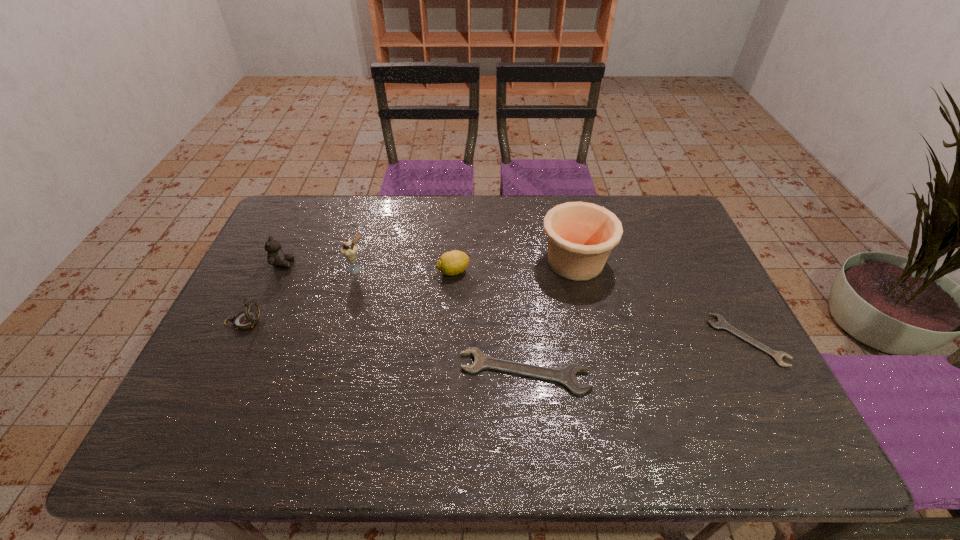
This screenshot has height=540, width=960. In order to click on free location that satisfies the following two spatial constraints: 1. on the front side of the pottery; 2. on the face of the teddy bear in this screenshot , I will do `click(576, 264)`.

This screenshot has width=960, height=540. In order to click on free location that satisfies the following two spatial constraints: 1. on the face of the teddy bear; 2. on the back side of the icecream in this screenshot , I will do `click(280, 269)`.

In order to click on free point that satisfies the following two spatial constraints: 1. on the back side of the shorter wrench; 2. on the face of the teddy bear in this screenshot , I will do `click(707, 264)`.

At what (x,y) coordinates should I click in order to perform the action: click on vacant space that satisfies the following two spatial constraints: 1. on the front side of the pottery; 2. on the left side of the right wrench. Please return your answer as a coordinate pair (x, y). The image size is (960, 540). Looking at the image, I should click on (593, 340).

The height and width of the screenshot is (540, 960). I want to click on free space that satisfies the following two spatial constraints: 1. at the stem end of the rightmost object; 2. on the right side of the lemon, so click(x=449, y=340).

This screenshot has height=540, width=960. Identify the location of vacant position in the image that satisfies the following two spatial constraints: 1. on the face of the teddy bear; 2. on the left side of the fifth object from right to left. (280, 269).